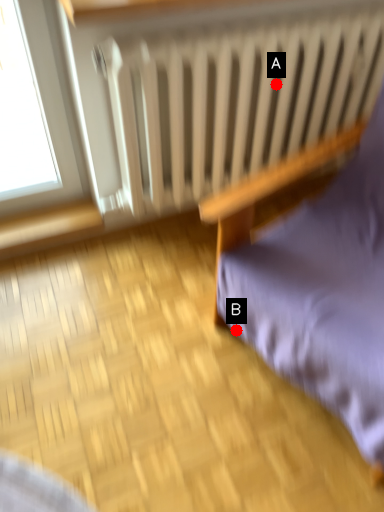
Question: Two points are circled on the image, labeled by A and B beside each circle. Which point appears farthest from the camera in this image?

Choices:
 (A) A is further
 (B) B is further

Answer: (A)